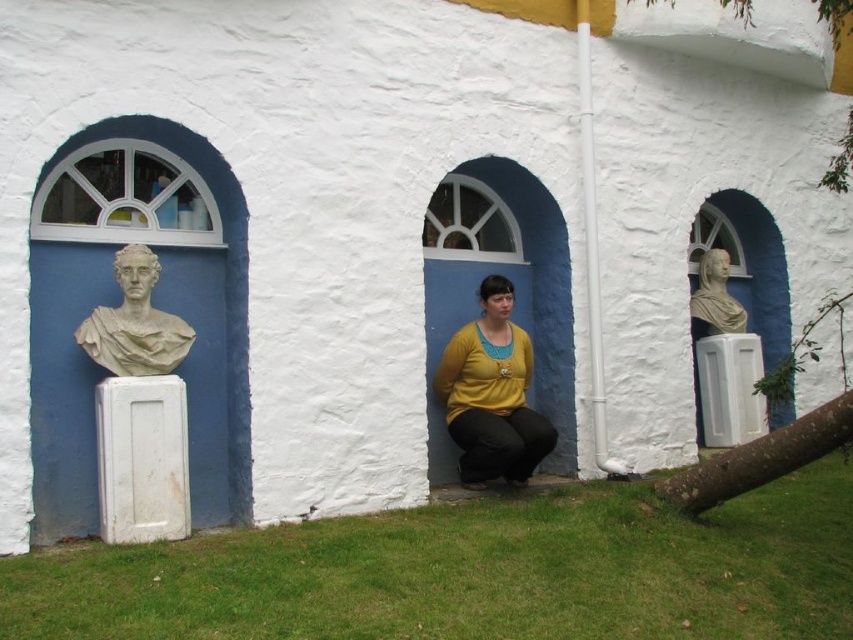
Is point (166, 324) in front of point (711, 292)?

Yes.

In the scene shown: Is white marble bust at left to the right of white marble bust at center right from the viewer's perspective?

In fact, white marble bust at left is to the left of white marble bust at center right.

Who is more distant from viewer, (141, 371) or (714, 256)?

Positioned behind is point (714, 256).

Where is `white marble bust at left`? white marble bust at left is located at coordinates (134, 323).

Consider the image. Who is more distant from viewer, (x=663, y=492) or (x=183, y=321)?

Point (x=183, y=321)

Does brown rough bark tree at lower right appear under white marble bust at left?

Actually, brown rough bark tree at lower right is above white marble bust at left.

Measure the distance between point (782,451) and camera.

Point (782,451) is 4.74 meters from camera.

Where is `brown rough bark tree at lower right`? This screenshot has width=853, height=640. brown rough bark tree at lower right is located at coordinates (761, 458).

Who is more distant from viewer, [454,362] or [751,468]?

The point [454,362] is behind.

Does point (479, 408) lie behind point (775, 465)?

Yes, point (479, 408) is behind point (775, 465).

Locate an element on the screen. yellow matte shirt at center is located at coordinates (492, 394).